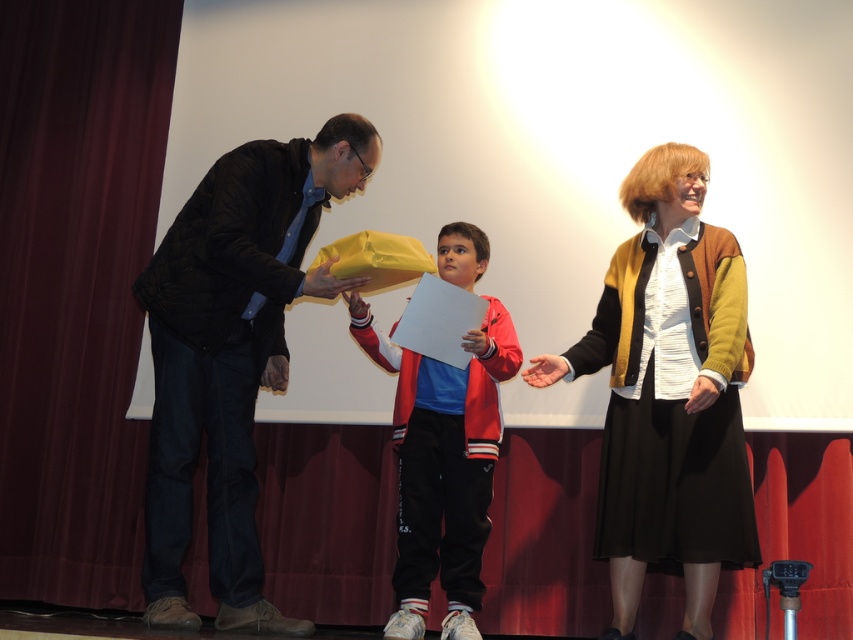
Is maroon fabric curtain at left to the left of matte red jacket at center from the viewer's perspective?

Yes, maroon fabric curtain at left is to the left of matte red jacket at center.

Between maroon fabric curtain at left and matte red jacket at center, which one appears on the left side from the viewer's perspective?

From the viewer's perspective, maroon fabric curtain at left appears more on the left side.

Does point (131, 10) come closer to viewer compared to point (474, 358)?

No, it is behind (474, 358).

Identify the location of maroon fabric curtain at left. (76, 288).

Can you confirm if maroon fabric curtain at left is positioned to the left of black woolen cardigan at center?

Yes, maroon fabric curtain at left is to the left of black woolen cardigan at center.

Which is below, maroon fabric curtain at left or black woolen cardigan at center?

black woolen cardigan at center is below.

Is point (21, 237) positioned in front of point (721, 465)?

No.

This screenshot has width=853, height=640. What are the coordinates of `maroon fabric curtain at left` in the screenshot? It's located at (76, 288).

Does matte black jacket at left have a greater width compared to matte red jacket at center?

Correct, the width of matte black jacket at left exceeds that of matte red jacket at center.

Find the location of a particular element. This screenshot has height=640, width=853. matte black jacket at left is located at coordinates (231, 355).

The width and height of the screenshot is (853, 640). I want to click on matte black jacket at left, so click(x=231, y=355).